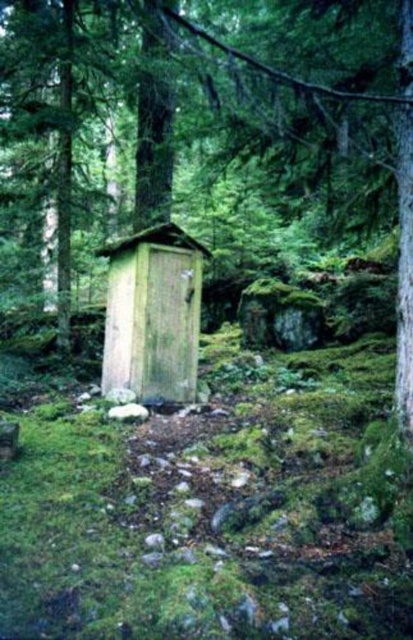
Question: Does smooth wooden outhouse at center appear on the left side of wooden hut at center?

Choices:
 (A) no
 (B) yes

Answer: (B)

Question: Is smooth wooden outhouse at center positioned in front of wooden hut at center?

Choices:
 (A) yes
 (B) no

Answer: (B)

Question: Is smooth wooden outhouse at center wider than wooden hut at center?

Choices:
 (A) no
 (B) yes

Answer: (A)